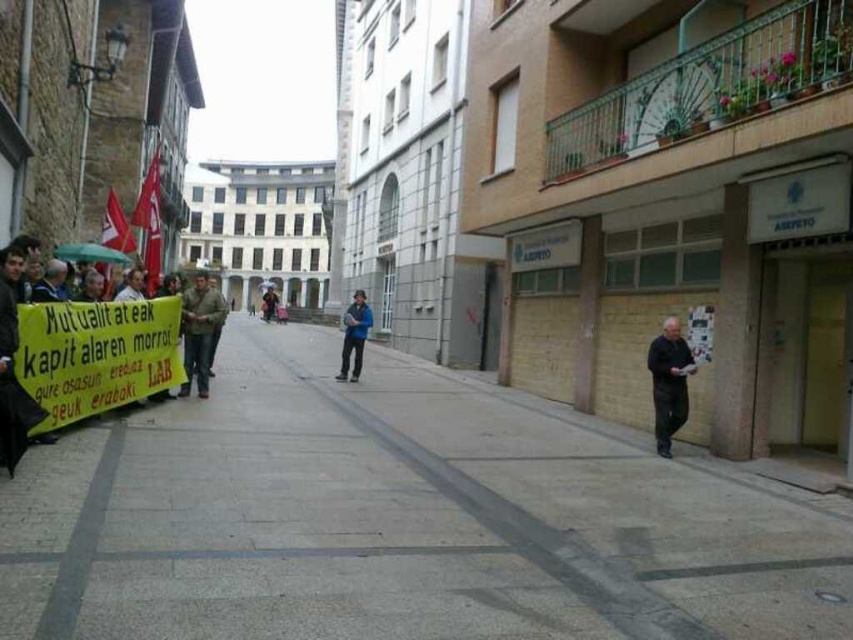
In the scene shown: Which of these two, camouflage fabric jacket at center or blue fabric jacket at center, stands shorter?

blue fabric jacket at center

Is point (187, 344) positioned after point (358, 330)?

No, it is not.

Image resolution: width=853 pixels, height=640 pixels. Identify the location of camouflage fabric jacket at center. (199, 330).

Does gray concrete pavement at center appear over black matte jacket at lower right?

No, gray concrete pavement at center is not above black matte jacket at lower right.

Find the location of `gray concrete pavement at center`. gray concrete pavement at center is located at coordinates (402, 518).

Can you confirm if gray concrete pavement at center is shorter than blue fabric jacket at center?

Indeed, gray concrete pavement at center has a lesser height compared to blue fabric jacket at center.

Is point (822, 547) closer to viewer compared to point (358, 317)?

Yes, it is.

This screenshot has width=853, height=640. Identify the location of gray concrete pavement at center. (402, 518).